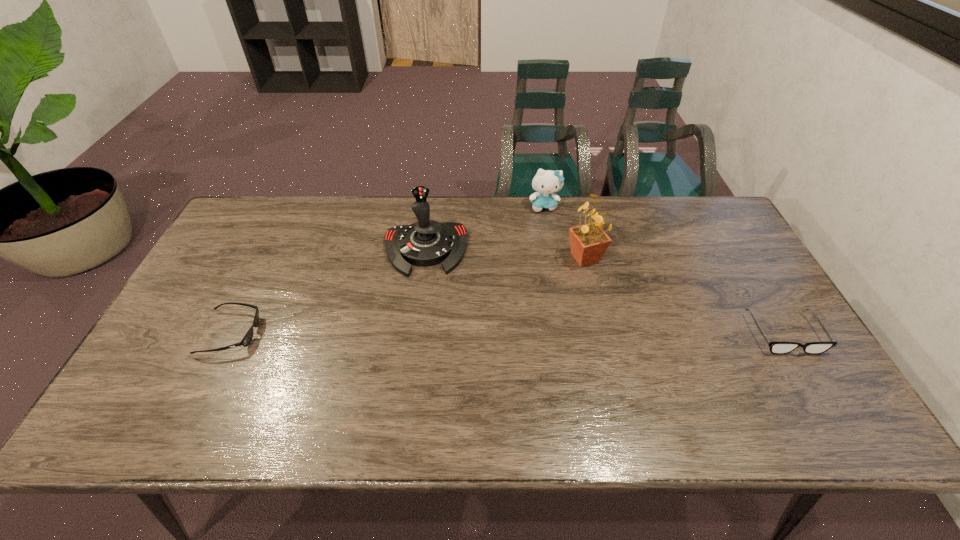
Identify the location of the shortest object. [x=247, y=339].

Where is `the leftmost object`? This screenshot has width=960, height=540. the leftmost object is located at coordinates (247, 339).

Locate an element on the screen. This screenshot has height=540, width=960. spectacles is located at coordinates (775, 347).

At what (x,y) coordinates should I click in order to perform the action: click on sunflower. Please return your answer as a coordinate pair (x, y). The image size is (960, 540). Looking at the image, I should click on 588,242.

Where is `joystick`? The width and height of the screenshot is (960, 540). joystick is located at coordinates (425, 243).

Locate an element on the screen. This screenshot has height=540, width=960. kitten is located at coordinates (546, 182).

Locate an element on the screen. This screenshot has width=960, height=540. the farthest object is located at coordinates (546, 182).

Identify the location of vacant space positioned on the front-facing side of the sunglasses. (331, 333).

You are a GUI agent. You are given a task and a screenshot of the screen. Output one action in this format:
    pyautogui.click(x=<x>, y=<y>)
    Task: Click on the free space located on the front-facing side of the rightmost object
    This screenshot has width=960, height=540.
    Given the screenshot: What is the action you would take?
    pyautogui.click(x=816, y=388)

I want to click on free spot located at the front of the sunflower with flowers visible, so click(547, 342).